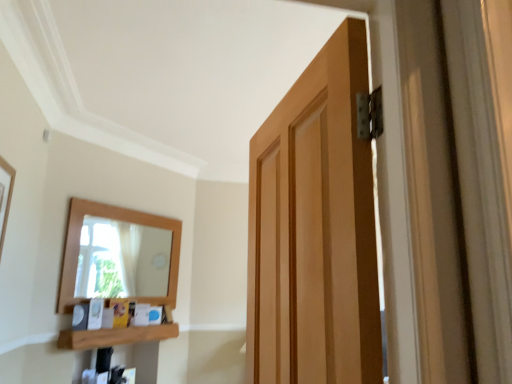
Identify the location of wooden at lower left. Image resolution: width=512 pixels, height=384 pixels. (115, 336).

What do you see at coordinates (115, 336) in the screenshot? I see `wooden at lower left` at bounding box center [115, 336].

This screenshot has height=384, width=512. What do you see at coordinates (5, 196) in the screenshot?
I see `wooden picture frame at left` at bounding box center [5, 196].

Locate an element on the screen. wooden picture frame at left is located at coordinates (5, 196).

You are a GUI agent. You are given a task and a screenshot of the screen. Output one action in this format:
    pyautogui.click(x=<x>, y=<y>)
    Task: Click on the wooden at lower left
    The width and height of the screenshot is (512, 384).
    Given the screenshot: What is the action you would take?
    pyautogui.click(x=115, y=336)

Between wooden picture frame at left and wooden at lower left, which one appears on the left side from the viewer's perspective?

Positioned to the left is wooden picture frame at left.

Considering the positions of objects wooden picture frame at left and wooden at lower left in the image provided, who is in front, wooden picture frame at left or wooden at lower left?

Positioned in front is wooden picture frame at left.

Between point (3, 187) and point (78, 344), which one is positioned in front?

The point (3, 187) is more forward.

From the image's perspective, is wooden picture frame at left positioned above or below wooden at lower left?

From the image's perspective, wooden picture frame at left appears above wooden at lower left.

From a real-world perspective, who is located lower, wooden picture frame at left or wooden at lower left?

wooden at lower left.

Which of these two, wooden picture frame at left or wooden at lower left, is thinner?

Thinner between the two is wooden picture frame at left.

Can you confirm if wooden picture frame at left is taller than wooden at lower left?

Correct, wooden picture frame at left is much taller as wooden at lower left.

Which of these two, wooden picture frame at left or wooden at lower left, is bigger?

With larger size is wooden at lower left.

Can wooden at lower left be found inside wooden picture frame at left?

No, wooden at lower left is located outside of wooden picture frame at left.

From the picture: Does wooden picture frame at left touch wooden at lower left?

No, wooden picture frame at left is not making contact with wooden at lower left.

Is wooden picture frame at left looking in the opposite direction of wooden at lower left?

That's not correct — wooden picture frame at left is not looking away from wooden at lower left.

How many degrees apart are the facing directions of wooden picture frame at left and wooden at lower left?

There is a 45.1-degree angle between the facing directions of wooden picture frame at left and wooden at lower left.

This screenshot has height=384, width=512. What are the coordinates of `shelf that appears below the wooden picture frame at left (from a real-world perspective)` in the screenshot? It's located at (115, 336).

Which is more to the left, wooden at lower left or wooden picture frame at left?

wooden picture frame at left is more to the left.

Which object is more forward, wooden at lower left or wooden picture frame at left?

wooden picture frame at left is in front.

Considering the points (99, 346) and (2, 242), which point is in front, point (99, 346) or point (2, 242)?

The point (2, 242) is closer to the camera.

From the image's perspective, which is above, wooden at lower left or wooden picture frame at left?

wooden picture frame at left, from the image's perspective.

From a real-world perspective, is wooden at lower left positioned over wooden picture frame at left based on gravity?

No, from a real-world perspective, wooden at lower left is not above wooden picture frame at left.

Looking at their sizes, would you say wooden at lower left is wider or thinner than wooden picture frame at left?

Clearly, wooden at lower left has more width compared to wooden picture frame at left.

Considering the sizes of wooden at lower left and wooden picture frame at left in the image, is wooden at lower left taller or shorter than wooden picture frame at left?

wooden at lower left is shorter than wooden picture frame at left.

Considering the sizes of wooden at lower left and wooden picture frame at left in the image, is wooden at lower left bigger or smaller than wooden picture frame at left?

Clearly, wooden at lower left is larger in size than wooden picture frame at left.

Could wooden picture frame at left be considered to be inside wooden at lower left?

No, wooden picture frame at left is not a part of wooden at lower left.

Is the surface of wooden at lower left in direct contact with wooden picture frame at left?

No, wooden at lower left is not in contact with wooden picture frame at left.

From the picture: Is wooden picture frame at left at the back of wooden at lower left?

No, wooden at lower left is not facing the opposite direction of wooden picture frame at left.

Can you tell me how much wooden at lower left and wooden picture frame at left differ in facing direction?

The facing directions of wooden at lower left and wooden picture frame at left are 45.1 degrees apart.

Image resolution: width=512 pixels, height=384 pixels. Identify the location of picture frame that is above the wooden at lower left (from the image's perspective). (5, 196).

You are a GUI agent. You are given a task and a screenshot of the screen. Output one action in this format:
    pyautogui.click(x=<x>, y=<y>)
    Task: Click on the picture frame located on the left of wooden at lower left
    The image size is (512, 384).
    Given the screenshot: What is the action you would take?
    pyautogui.click(x=5, y=196)

I want to click on picture frame in front of the wooden at lower left, so click(x=5, y=196).